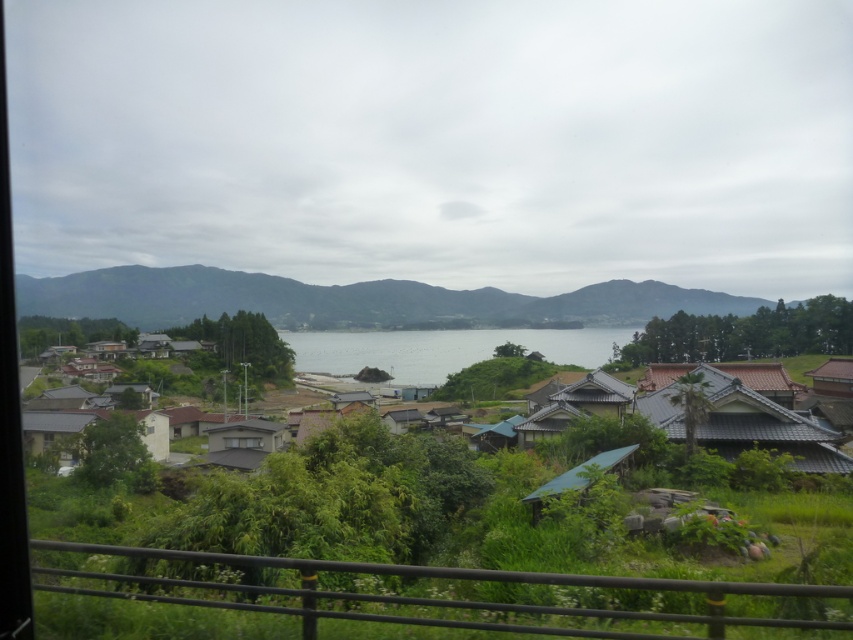
You are standing in the village and looking towards the green matte mountain at center and the transparent glass window at center. Which object is nearer to you?

The green matte mountain at center is closer to the viewer than the transparent glass window at center.

You are an architect designing a new building that needs to blend into the village. You have to decide between using a green matte mountain at center or a transparent glass window at center as a design element. Which one would you choose and why?

You should choose the green matte mountain at center because it is much taller than the transparent glass window at center, making it a more prominent and culturally significant feature to incorporate into the design.

You are an architect planning to build a new structure in the village. You notice the green matte mountain at center and the green matte hut at center in the background. Which of these two structures is larger in size?

The green matte mountain at center is bigger than the green matte hut at center, so the mountain is larger in size.